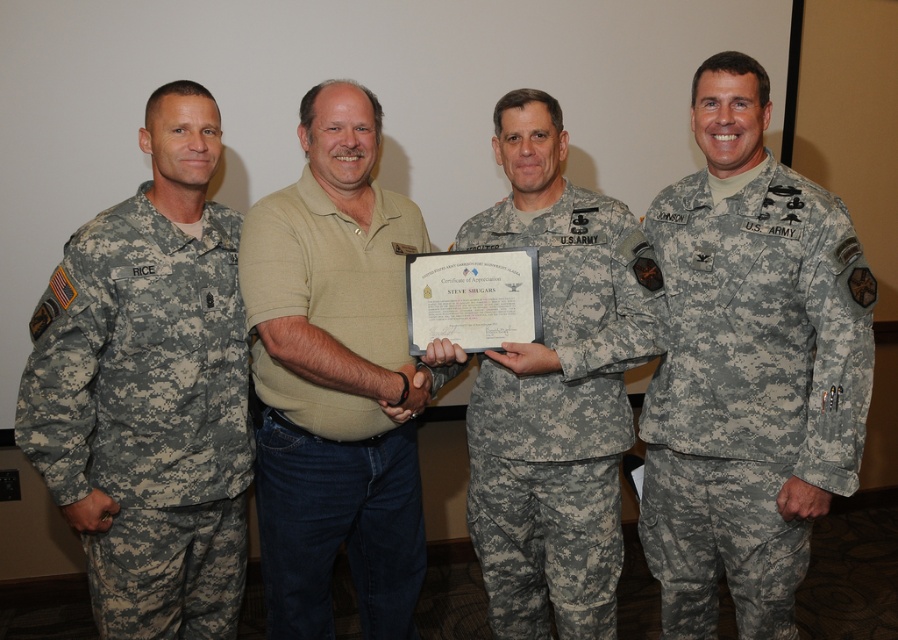
Does camouflage fabric uniform at right have a greater height compared to beige cotton polo shirt at center?

In fact, camouflage fabric uniform at right may be shorter than beige cotton polo shirt at center.

Does camouflage fabric uniform at right have a larger size compared to beige cotton polo shirt at center?

Actually, camouflage fabric uniform at right might be smaller than beige cotton polo shirt at center.

Who is more forward, (700, 289) or (406, 412)?

Point (406, 412) is in front.

Where is `camouflage fabric uniform at right`? This screenshot has height=640, width=898. camouflage fabric uniform at right is located at coordinates (750, 392).

Does camouflage fabric uniform at right have a smaller size compared to camouflage fabric uniform at left?

Incorrect, camouflage fabric uniform at right is not smaller in size than camouflage fabric uniform at left.

Does point (684, 589) lie behind point (147, 588)?

Yes.

Who is more forward, (832,298) or (122,300)?

Point (122,300) is in front.

Where is `camouflage fabric uniform at right`? This screenshot has width=898, height=640. camouflage fabric uniform at right is located at coordinates (750, 392).

Which is behind, point (40, 362) or point (474, 387)?

Point (474, 387)

Is camouflage fabric uniform at left wider than camouflage fabric uniform at center?

Incorrect, camouflage fabric uniform at left's width does not surpass camouflage fabric uniform at center's.

This screenshot has width=898, height=640. I want to click on camouflage fabric uniform at left, so click(x=147, y=413).